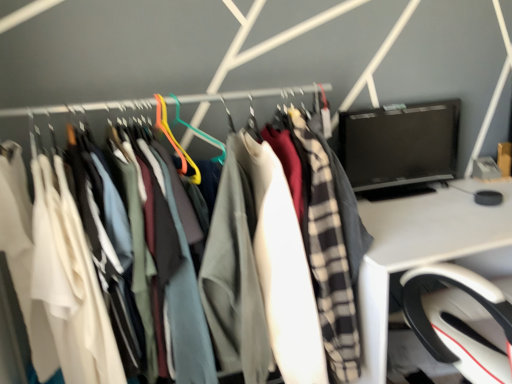
At what (x,y) coordinates should I click in order to perform the action: click on white glossy desk at right. Please return your answer as a coordinate pair (x, y). This screenshot has height=384, width=512. Looking at the image, I should click on (421, 249).

Where is `matte fabric clothes at left`? The height and width of the screenshot is (384, 512). matte fabric clothes at left is located at coordinates (106, 111).

Identify the location of white glossy desk at right. (421, 249).

Is point (139, 121) behind point (435, 234)?

That is False.

Image resolution: width=512 pixels, height=384 pixels. Find the location of `closet lying behind the white glossy desk at right`. closet lying behind the white glossy desk at right is located at coordinates (106, 111).

In the image, is matte fabric clothes at left on the left side or the right side of white glossy desk at right?

matte fabric clothes at left is positioned on white glossy desk at right's left side.

Is white glossy desk at right completely or partially inside matte fabric clothes at left?

Actually, white glossy desk at right is outside matte fabric clothes at left.

From the image's perspective, is black glossy monitor at upper right below white glossy desk at right?

No.

In the image, is black glossy monitor at upper right on the left side or the right side of white glossy desk at right?

Based on their positions, black glossy monitor at upper right is located to the left of white glossy desk at right.

Is black glossy monitor at upper right with white glossy desk at right?

No, black glossy monitor at upper right is not in contact with white glossy desk at right.

Is black glossy monitor at upper right not close to matte fabric clothes at left?

black glossy monitor at upper right is actually quite close to matte fabric clothes at left.

Does point (347, 174) appear closer or farther from the camera than point (156, 119)?

Clearly, point (347, 174) is more distant from the camera than point (156, 119).

Which of these two, black glossy monitor at upper right or matte fabric clothes at left, is smaller?

black glossy monitor at upper right is smaller.

In the image, is black glossy monitor at upper right positioned in front of or behind matte fabric clothes at left?

black glossy monitor at upper right is behind matte fabric clothes at left.

The width and height of the screenshot is (512, 384). I want to click on closet lying above the white glossy desk at right (from the image's perspective), so click(106, 111).

Considering the positions of point (418, 218) and point (198, 135), is point (418, 218) closer or farther from the camera than point (198, 135)?

Point (418, 218) appears to be farther away from the viewer than point (198, 135).

Does white glossy desk at right lie in front of matte fabric clothes at left?

Yes.

Is matte fabric clothes at left facing towards black glossy monitor at upper right?

No, matte fabric clothes at left is not aimed at black glossy monitor at upper right.

Does matte fabric clothes at left contain black glossy monitor at upper right?

Definitely not — black glossy monitor at upper right is not inside matte fabric clothes at left.

Which object is further away from the camera taking this photo, matte fabric clothes at left or black glossy monitor at upper right?

black glossy monitor at upper right.

Which object is thinner, white glossy desk at right or black glossy monitor at upper right?

black glossy monitor at upper right is thinner.

Is white glossy desk at right in contact with black glossy monitor at upper right?

white glossy desk at right and black glossy monitor at upper right are not in contact.

Is white glossy desk at right aimed at black glossy monitor at upper right?

Yes, white glossy desk at right faces towards black glossy monitor at upper right.

Locate an element on the screen. This screenshot has width=512, height=384. closet located behind the white glossy desk at right is located at coordinates (106, 111).

Identify the location of computer monitor above the white glossy desk at right (from the image's perspective). The height and width of the screenshot is (384, 512). (400, 148).

When comparing their distances from black glossy monitor at upper right, does matte fabric clothes at left or white glossy desk at right seem closer?

Based on the image, white glossy desk at right appears to be nearer to black glossy monitor at upper right.

Based on their spatial positions, is white glossy desk at right or matte fabric clothes at left further from black glossy monitor at upper right?

Based on the image, matte fabric clothes at left appears to be further to black glossy monitor at upper right.

Estimate the real-world distances between objects in this image. Which object is further from matte fabric clothes at left, white glossy desk at right or black glossy monitor at upper right?

black glossy monitor at upper right is further to matte fabric clothes at left.

Which object lies further to the anchor point matte fabric clothes at left, black glossy monitor at upper right or white glossy desk at right?

Among the two, black glossy monitor at upper right is located further to matte fabric clothes at left.

Estimate the real-world distances between objects in this image. Which object is closer to white glossy desk at right, matte fabric clothes at left or black glossy monitor at upper right?

black glossy monitor at upper right lies closer to white glossy desk at right than the other object.

Looking at the image, which one is located further to white glossy desk at right, black glossy monitor at upper right or matte fabric clothes at left?

The object further to white glossy desk at right is matte fabric clothes at left.

Identify the location of computer monitor situated between matte fabric clothes at left and white glossy desk at right from left to right. The height and width of the screenshot is (384, 512). (400, 148).